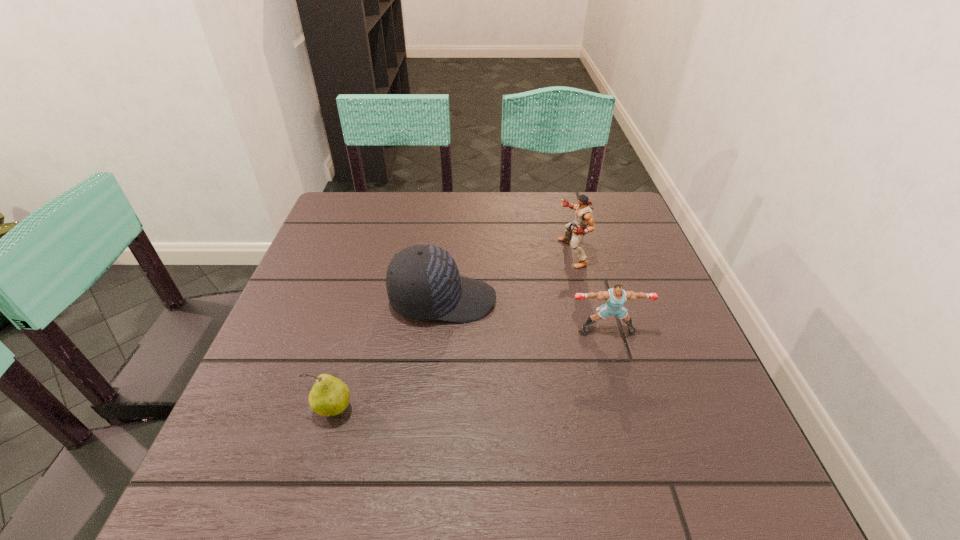
Identify the location of vacant space located on the front-facing side of the shorter puncher. The width and height of the screenshot is (960, 540). (628, 397).

In order to click on vacant area situated on the right of the shortest object in this screenshot , I will do `click(415, 409)`.

Find the location of a particular element. object located at the far edge is located at coordinates (584, 217).

This screenshot has width=960, height=540. Identify the location of object that is positioned at the left edge. (329, 396).

What are the coordinates of `object at the right edge` in the screenshot? It's located at (615, 297).

Where is `free space at the far edge of the desktop`? This screenshot has width=960, height=540. free space at the far edge of the desktop is located at coordinates (468, 207).

The width and height of the screenshot is (960, 540). Find the location of `free region at the near edge of the desktop`. free region at the near edge of the desktop is located at coordinates (607, 488).

Where is `vacant space at the left edge of the desktop`? vacant space at the left edge of the desktop is located at coordinates (305, 260).

Image resolution: width=960 pixels, height=540 pixels. Identify the location of vacant region at the right edge of the desktop. (648, 263).

The width and height of the screenshot is (960, 540). I want to click on vacant space at the far left corner of the desktop, so click(356, 234).